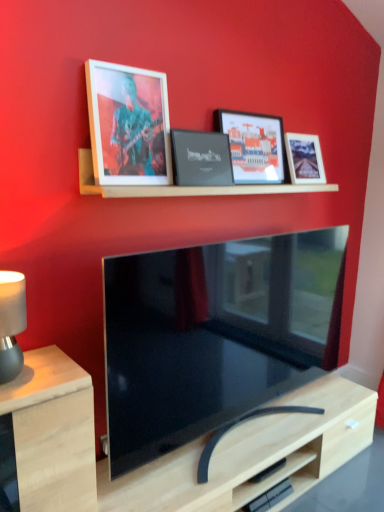
Question: Should I look upward or downward to see matte black lampshade at left?

Choices:
 (A) up
 (B) down

Answer: (B)

Question: Can you confirm if light wood table at lower left is bigger than black matte picture frame at center, which is the 2th picture frame from left to right?

Choices:
 (A) no
 (B) yes

Answer: (B)

Question: From a real-world perspective, is light wood table at lower left positioned under black matte picture frame at center, placed as the third picture frame when sorted from right to left, based on gravity?

Choices:
 (A) yes
 (B) no

Answer: (A)

Question: Does light wood table at lower left have a lesser width compared to black matte picture frame at center, which is the 2th picture frame from left to right?

Choices:
 (A) no
 (B) yes

Answer: (A)

Question: Is light wood table at lower left oriented away from black matte picture frame at center, placed as the third picture frame when sorted from right to left?

Choices:
 (A) yes
 (B) no

Answer: (B)

Question: Is light wood table at lower left oriented towards black matte picture frame at center, which is the 2th picture frame from left to right?

Choices:
 (A) no
 (B) yes

Answer: (A)

Question: Is light wood table at lower left closer to the viewer compared to black matte picture frame at center, placed as the third picture frame when sorted from right to left?

Choices:
 (A) no
 (B) yes

Answer: (B)

Question: Is matte black lampshade at left wider than black matte picture frame at center, which is the 2th picture frame from left to right?

Choices:
 (A) yes
 (B) no

Answer: (A)

Question: Does matte black lampshade at left lie behind black matte picture frame at center, which is the 2th picture frame from left to right?

Choices:
 (A) yes
 (B) no

Answer: (B)

Question: Can you confirm if matte black lampshade at left is positioned to the right of black matte picture frame at center, placed as the third picture frame when sorted from right to left?

Choices:
 (A) yes
 (B) no

Answer: (B)

Question: Is matte black lampshade at left looking in the opposite direction of black matte picture frame at center, placed as the third picture frame when sorted from right to left?

Choices:
 (A) yes
 (B) no

Answer: (B)

Question: Is matte black lampshade at left not within black matte picture frame at center, which is the 2th picture frame from left to right?

Choices:
 (A) no
 (B) yes

Answer: (B)

Question: Would you say matte black lampshade at left contains black matte picture frame at center, placed as the third picture frame when sorted from right to left?

Choices:
 (A) no
 (B) yes

Answer: (A)

Question: Is matte black picture frame at upper center, positioned as the third picture frame in left-to-right order, at the left side of matte black lampshade at left?

Choices:
 (A) yes
 (B) no

Answer: (B)